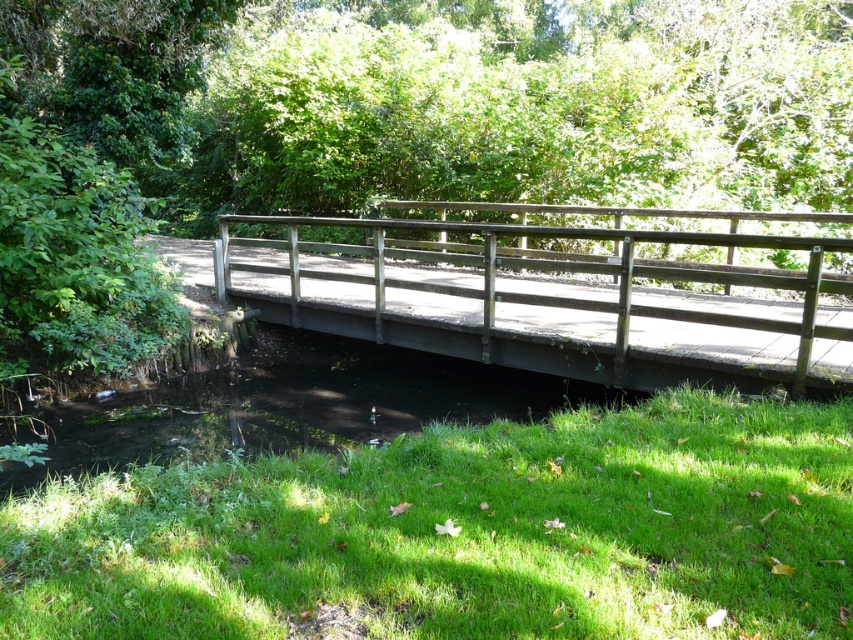
Is green grass at lower center to the right of wooden bridge at center from the viewer's perspective?

Incorrect, green grass at lower center is not on the right side of wooden bridge at center.

Can you confirm if green grass at lower center is thinner than wooden bridge at center?

Indeed, green grass at lower center has a lesser width compared to wooden bridge at center.

At what (x,y) coordinates should I click in order to perform the action: click on green grass at lower center. Please return your answer as a coordinate pair (x, y). The height and width of the screenshot is (640, 853). Looking at the image, I should click on (462, 532).

Based on the photo, can you confirm if green grass at lower center is shorter than green leafy tree at center?

Correct, green grass at lower center is not as tall as green leafy tree at center.

The width and height of the screenshot is (853, 640). What do you see at coordinates (462, 532) in the screenshot? I see `green grass at lower center` at bounding box center [462, 532].

Is point (242, 618) farther from camera compared to point (0, 19)?

No, (242, 618) is in front of (0, 19).

Identify the location of green grass at lower center. (462, 532).

Does point (386, 147) come in front of point (450, 292)?

That is False.

Is point (712, 60) positioned behind point (802, 356)?

Yes, it is behind point (802, 356).

Where is `green leafy tree at center`? The image size is (853, 640). green leafy tree at center is located at coordinates (445, 99).